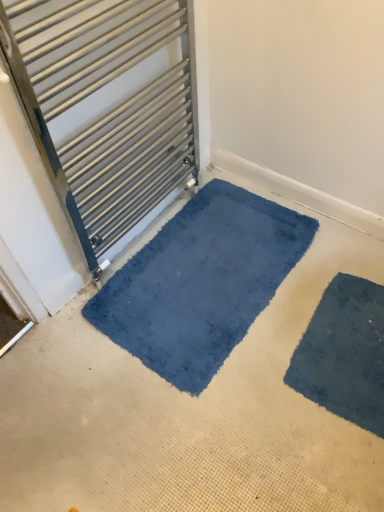
Identify the location of satin silver towel rail at upper left. (105, 106).

What do you see at coordinates (105, 106) in the screenshot?
I see `satin silver towel rail at upper left` at bounding box center [105, 106].

Locate an element on the screen. The width and height of the screenshot is (384, 512). blue plush mat at lower center is located at coordinates (201, 282).

Identify the location of dark blue plush bath mat at lower right. The height and width of the screenshot is (512, 384). (344, 353).

Find the location of a particular element. The width and height of the screenshot is (384, 512). satin silver towel rail at upper left is located at coordinates (105, 106).

Is blue soft carpet at center placed right next to blue plush mat at lower center?

No, blue soft carpet at center is not in contact with blue plush mat at lower center.

Visually, is blue soft carpet at center positioned to the left or to the right of blue plush mat at lower center?

Based on their positions, blue soft carpet at center is located to the right of blue plush mat at lower center.

From a real-world perspective, relative to blue plush mat at lower center, is blue soft carpet at center vertically above or below?

In terms of real-world spatial position, blue soft carpet at center is below blue plush mat at lower center.

Is blue soft carpet at center not inside blue plush mat at lower center?

No, blue soft carpet at center is inside blue plush mat at lower center's boundary.

Does satin silver towel rail at upper left have a greater height compared to blue soft carpet at center?

Correct, satin silver towel rail at upper left is much taller as blue soft carpet at center.

Do you think satin silver towel rail at upper left is within blue soft carpet at center, or outside of it?

satin silver towel rail at upper left is spatially situated outside blue soft carpet at center.

Which of these two, satin silver towel rail at upper left or blue soft carpet at center, is wider?

With larger width is blue soft carpet at center.

Does satin silver towel rail at upper left have a smaller size compared to blue soft carpet at center?

Yes.

Is dark blue plush bath mat at lower right at the back of satin silver towel rail at upper left?

satin silver towel rail at upper left is not turned away from dark blue plush bath mat at lower right.

Is satin silver towel rail at upper left touching dark blue plush bath mat at lower right?

No, satin silver towel rail at upper left is not beside dark blue plush bath mat at lower right.

In terms of width, does satin silver towel rail at upper left look wider or thinner when compared to dark blue plush bath mat at lower right?

Clearly, satin silver towel rail at upper left has less width compared to dark blue plush bath mat at lower right.

The width and height of the screenshot is (384, 512). In order to click on bath mat below the satin silver towel rail at upper left (from the image's perspective) in this screenshot , I will do [x=344, y=353].

From the image's perspective, which object appears higher, blue plush mat at lower center or satin silver towel rail at upper left?

satin silver towel rail at upper left appears higher in the image.

Is satin silver towel rail at upper left a part of blue plush mat at lower center?

No, satin silver towel rail at upper left is not a part of blue plush mat at lower center.

Considering the relative sizes of blue plush mat at lower center and satin silver towel rail at upper left in the image provided, is blue plush mat at lower center shorter than satin silver towel rail at upper left?

Indeed, blue plush mat at lower center has a lesser height compared to satin silver towel rail at upper left.

Which is more to the left, blue plush mat at lower center or satin silver towel rail at upper left?

Positioned to the left is satin silver towel rail at upper left.

In the scene shown: Is dark blue plush bath mat at lower right placed right next to satin silver towel rail at upper left?

No, dark blue plush bath mat at lower right is not with satin silver towel rail at upper left.

Is dark blue plush bath mat at lower right to the right of satin silver towel rail at upper left from the viewer's perspective?

Yes.

From a real-world perspective, which object stands above the other?

satin silver towel rail at upper left.

Is dark blue plush bath mat at lower right positioned with its back to satin silver towel rail at upper left?

That's not correct — dark blue plush bath mat at lower right is not looking away from satin silver towel rail at upper left.

Consider the image. Which is closer to the camera, (254, 416) or (338, 339)?

The point (254, 416) is in front.

Is blue soft carpet at center turned away from dark blue plush bath mat at lower right?

Correct, blue soft carpet at center is looking away from dark blue plush bath mat at lower right.

Is blue soft carpet at center not inside dark blue plush bath mat at lower right?

That's correct, blue soft carpet at center is outside of dark blue plush bath mat at lower right.

Would you consider blue soft carpet at center to be distant from dark blue plush bath mat at lower right?

No, there isn't a large distance between blue soft carpet at center and dark blue plush bath mat at lower right.

I want to click on concrete that is on the right side of blue plush mat at lower center, so pos(188,411).

Considering the sizes of objects blue plush mat at lower center and blue soft carpet at center in the image provided, who is wider, blue plush mat at lower center or blue soft carpet at center?

blue soft carpet at center.

From the image's perspective, is blue plush mat at lower center under blue soft carpet at center?

No.

I want to click on mat above the blue soft carpet at center (from a real-world perspective), so click(201, 282).

Where is `door that appears on the left of blue soft carpet at center`? Image resolution: width=384 pixels, height=512 pixels. door that appears on the left of blue soft carpet at center is located at coordinates (105, 106).

Estimate the real-world distances between objects in this image. Which object is closer to satin silver towel rail at upper left, dark blue plush bath mat at lower right or blue soft carpet at center?

Among the two, blue soft carpet at center is located nearer to satin silver towel rail at upper left.

Estimate the real-world distances between objects in this image. Which object is further from blue plush mat at lower center, dark blue plush bath mat at lower right or satin silver towel rail at upper left?

satin silver towel rail at upper left is positioned further to the anchor blue plush mat at lower center.

Looking at the image, which one is located further to dark blue plush bath mat at lower right, blue plush mat at lower center or satin silver towel rail at upper left?

satin silver towel rail at upper left lies further to dark blue plush bath mat at lower right than the other object.

Based on their spatial positions, is blue plush mat at lower center or satin silver towel rail at upper left further from blue soft carpet at center?

The object further to blue soft carpet at center is satin silver towel rail at upper left.

Looking at the image, which one is located closer to blue soft carpet at center, satin silver towel rail at upper left or blue plush mat at lower center?

blue plush mat at lower center.

Estimate the real-world distances between objects in this image. Which object is further from blue soft carpet at center, dark blue plush bath mat at lower right or satin silver towel rail at upper left?

satin silver towel rail at upper left lies further to blue soft carpet at center than the other object.

Which object lies further to the anchor point blue plush mat at lower center, blue soft carpet at center or satin silver towel rail at upper left?

Based on the image, satin silver towel rail at upper left appears to be further to blue plush mat at lower center.

Based on the photo, from the image, which object appears to be nearer to blue plush mat at lower center, satin silver towel rail at upper left or dark blue plush bath mat at lower right?

The object closer to blue plush mat at lower center is dark blue plush bath mat at lower right.

This screenshot has width=384, height=512. In order to click on mat located between satin silver towel rail at upper left and dark blue plush bath mat at lower right in the left-right direction in this screenshot , I will do `click(201, 282)`.

Locate an element on the screen. Image resolution: width=384 pixels, height=512 pixels. bath mat that lies between satin silver towel rail at upper left and blue soft carpet at center from top to bottom is located at coordinates (344, 353).

This screenshot has width=384, height=512. What are the coordinates of `mat between satin silver towel rail at upper left and blue soft carpet at center from top to bottom` in the screenshot? It's located at (201, 282).

Locate an element on the screen. concrete between blue plush mat at lower center and dark blue plush bath mat at lower right is located at coordinates (188, 411).